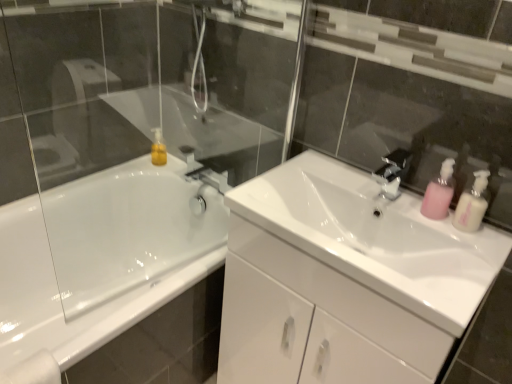
Question: From a real-world perspective, is pink plastic soap dispenser at right, the first soap dispenser viewed from the right, physically above pink plastic soap dispenser at right, acting as the second soap dispenser starting from the right?

Choices:
 (A) yes
 (B) no

Answer: (A)

Question: Is pink plastic soap dispenser at right, the second soap dispenser in the left-to-right sequence, located outside pink plastic soap dispenser at right, the 1th soap dispenser when ordered from left to right?

Choices:
 (A) yes
 (B) no

Answer: (A)

Question: Would you say pink plastic soap dispenser at right, the 1th soap dispenser when ordered from left to right, is part of pink plastic soap dispenser at right, the second soap dispenser in the left-to-right sequence,'s contents?

Choices:
 (A) yes
 (B) no

Answer: (B)

Question: Considering the relative sizes of pink plastic soap dispenser at right, the first soap dispenser viewed from the right, and pink plastic soap dispenser at right, acting as the second soap dispenser starting from the right, in the image provided, is pink plastic soap dispenser at right, the first soap dispenser viewed from the right, thinner than pink plastic soap dispenser at right, acting as the second soap dispenser starting from the right,?

Choices:
 (A) no
 (B) yes

Answer: (B)

Question: Can you confirm if pink plastic soap dispenser at right, the second soap dispenser in the left-to-right sequence, is taller than pink plastic soap dispenser at right, acting as the second soap dispenser starting from the right?

Choices:
 (A) no
 (B) yes

Answer: (A)

Question: Based on their sizes in the image, would you say white glossy sink at center is bigger or smaller than pink plastic soap dispenser at right, the first soap dispenser viewed from the right?

Choices:
 (A) small
 (B) big

Answer: (B)

Question: Is point (333, 195) closer or farther from the camera than point (455, 213)?

Choices:
 (A) farther
 (B) closer

Answer: (A)

Question: From the image's perspective, is white glossy sink at center positioned above or below pink plastic soap dispenser at right, the second soap dispenser in the left-to-right sequence?

Choices:
 (A) below
 (B) above

Answer: (A)

Question: Would you say white glossy sink at center is to the left or to the right of pink plastic soap dispenser at right, the first soap dispenser viewed from the right, in the picture?

Choices:
 (A) right
 (B) left

Answer: (B)

Question: Considering the positions of white glossy bathtub at left and white glossy sink at center in the image, is white glossy bathtub at left wider or thinner than white glossy sink at center?

Choices:
 (A) thin
 (B) wide

Answer: (B)

Question: Is white glossy bathtub at left in front of or behind white glossy sink at center in the image?

Choices:
 (A) front
 (B) behind

Answer: (B)

Question: Is point (5, 329) positioned closer to the camera than point (233, 208)?

Choices:
 (A) farther
 (B) closer

Answer: (A)

Question: From a real-world perspective, is white glossy bathtub at left physically located above or below white glossy sink at center?

Choices:
 (A) above
 (B) below

Answer: (B)

Question: From the image's perspective, is pink plastic soap dispenser at right, acting as the second soap dispenser starting from the right, positioned above or below white glossy sink at center?

Choices:
 (A) above
 (B) below

Answer: (A)

Question: From a real-world perspective, is pink plastic soap dispenser at right, the 1th soap dispenser when ordered from left to right, above or below white glossy sink at center?

Choices:
 (A) above
 (B) below

Answer: (A)